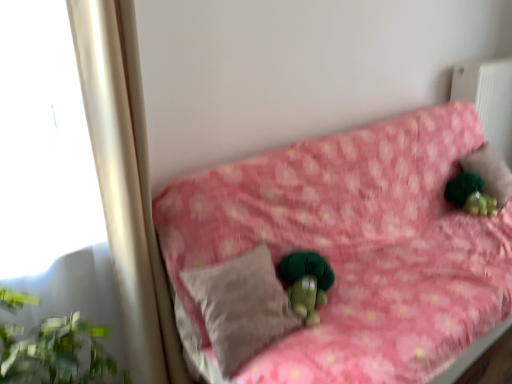
Question: Could you tell me if green fuzzy figurine at upper right is turned towards pink floral fabric couch at center?

Choices:
 (A) yes
 (B) no

Answer: (A)

Question: Does green fuzzy figurine at upper right have a greater width compared to pink floral fabric couch at center?

Choices:
 (A) no
 (B) yes

Answer: (A)

Question: Is green fuzzy figurine at upper right shorter than pink floral fabric couch at center?

Choices:
 (A) yes
 (B) no

Answer: (A)

Question: Can you confirm if green fuzzy figurine at upper right is bigger than pink floral fabric couch at center?

Choices:
 (A) no
 (B) yes

Answer: (A)

Question: From a real-world perspective, is green fuzzy figurine at upper right on top of pink floral fabric couch at center?

Choices:
 (A) yes
 (B) no

Answer: (A)

Question: Is pink floral fabric couch at center bigger or smaller than beige soft pillow at center, acting as the second pillow starting from the back?

Choices:
 (A) small
 (B) big

Answer: (B)

Question: Is pink floral fabric couch at center to the left or to the right of beige soft pillow at center, acting as the 2th pillow starting from the top, in the image?

Choices:
 (A) left
 (B) right

Answer: (B)

Question: Would you say pink floral fabric couch at center is inside or outside beige soft pillow at center, marked as the first pillow in a left-to-right arrangement?

Choices:
 (A) outside
 (B) inside

Answer: (A)

Question: Does point (322, 142) appear closer or farther from the camera than point (209, 276)?

Choices:
 (A) closer
 (B) farther

Answer: (B)

Question: Is beige fabric pillow at upper right, which is the 1th pillow in right-to-left order, bigger or smaller than green fuzzy figurine at upper right?

Choices:
 (A) big
 (B) small

Answer: (A)

Question: Considering their positions, is beige fabric pillow at upper right, positioned as the first pillow in top-to-bottom order, located in front of or behind green fuzzy figurine at upper right?

Choices:
 (A) front
 (B) behind

Answer: (B)

Question: In the image, is beige fabric pillow at upper right, positioned as the 1th pillow in back-to-front order, on the left side or the right side of green fuzzy figurine at upper right?

Choices:
 (A) right
 (B) left

Answer: (A)

Question: From the image's perspective, is beige fabric pillow at upper right, which is the 1th pillow in right-to-left order, above or below green fuzzy figurine at upper right?

Choices:
 (A) below
 (B) above

Answer: (B)

Question: Looking at their shapes, would you say green fuzzy figurine at upper right is wider or thinner than beige soft pillow at center, the 1th pillow ordered from the bottom?

Choices:
 (A) thin
 (B) wide

Answer: (A)

Question: Would you say green fuzzy figurine at upper right is inside or outside beige soft pillow at center, the 1th pillow ordered from the bottom?

Choices:
 (A) inside
 (B) outside

Answer: (B)